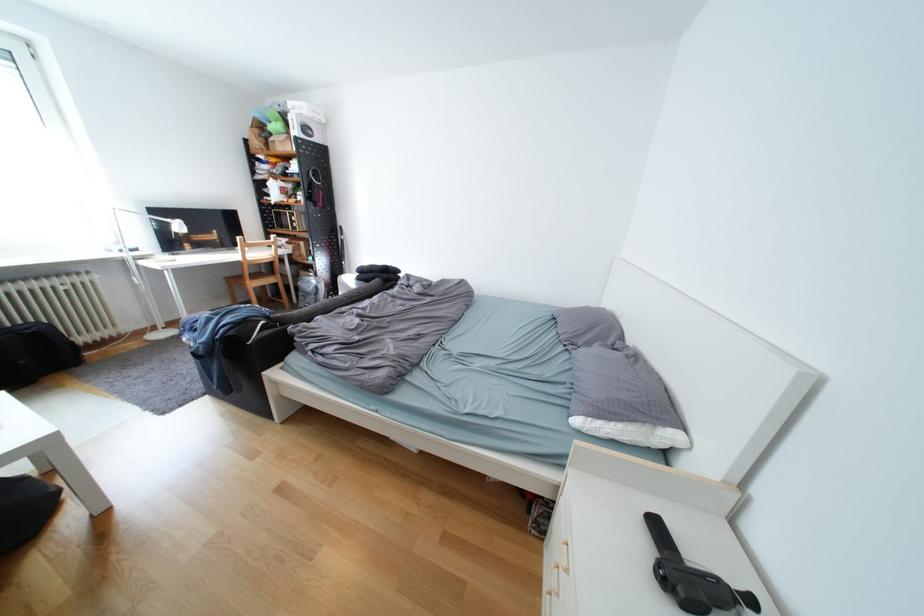
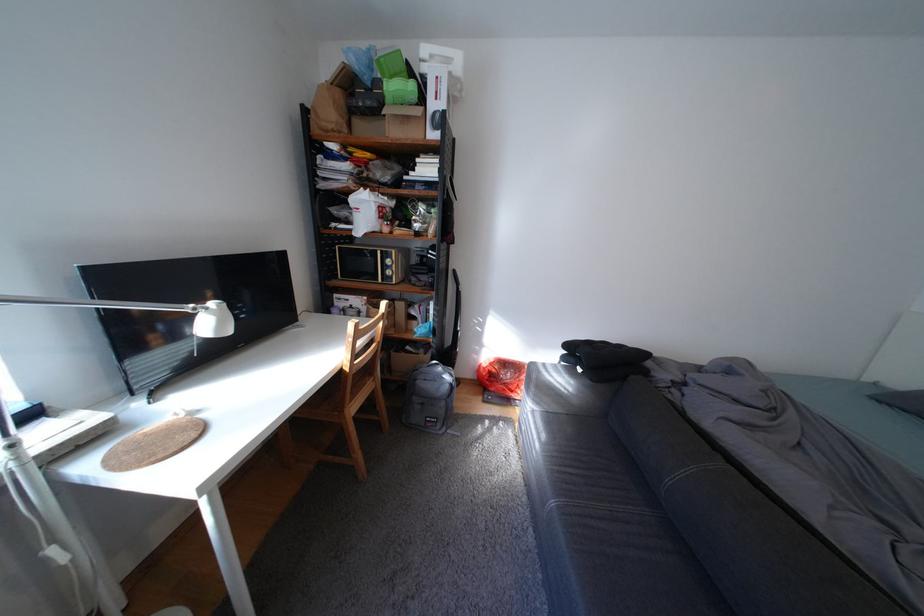
Where in the second image is the point corresponding to pixel 284 136 from the first image?

(395, 103)